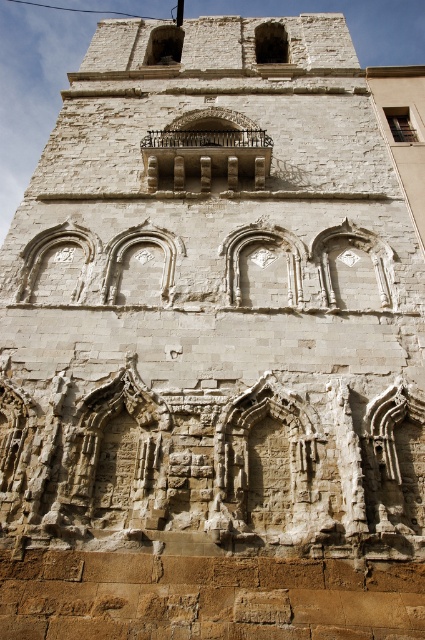
Question: Does smooth stone window at upper center appear under stone window at upper center?

Choices:
 (A) yes
 (B) no

Answer: (A)

Question: Among these objects, which one is nearest to the camera?

Choices:
 (A) stone window at upper center
 (B) white stone arch at center

Answer: (B)

Question: Estimate the real-world distances between objects in this image. Which object is farther from the matte stone window at upper right?

Choices:
 (A) stone window at upper center
 (B) smooth stone window at upper center
 (C) white stone arch at center

Answer: (B)

Question: Which object is the closest to the smooth stone window at upper center?

Choices:
 (A) white stone arch at center
 (B) matte stone window at upper right
 (C) stone window at upper center

Answer: (C)

Question: Observing the image, what is the correct spatial positioning of stone window at upper center in reference to matte stone window at upper right?

Choices:
 (A) left
 (B) right

Answer: (A)

Question: Does white stone arch at center appear on the left side of smooth stone window at upper center?

Choices:
 (A) no
 (B) yes

Answer: (A)